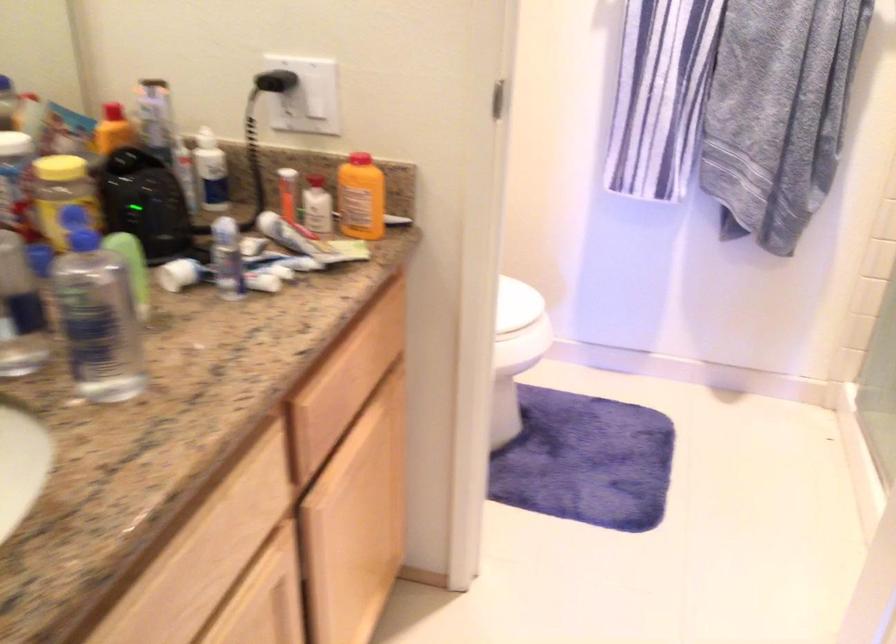
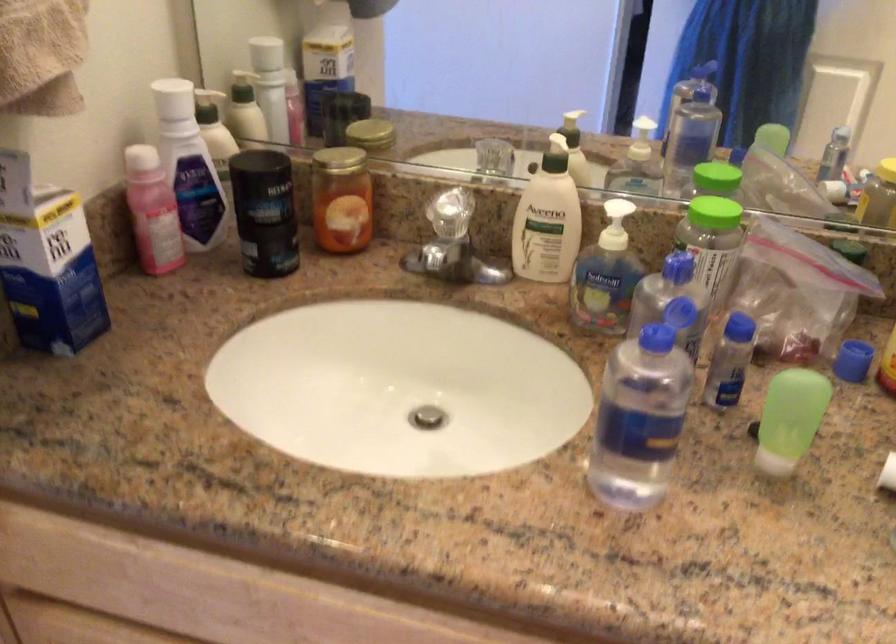
How did the camera likely rotate?

The camera's rotation is toward left-down.